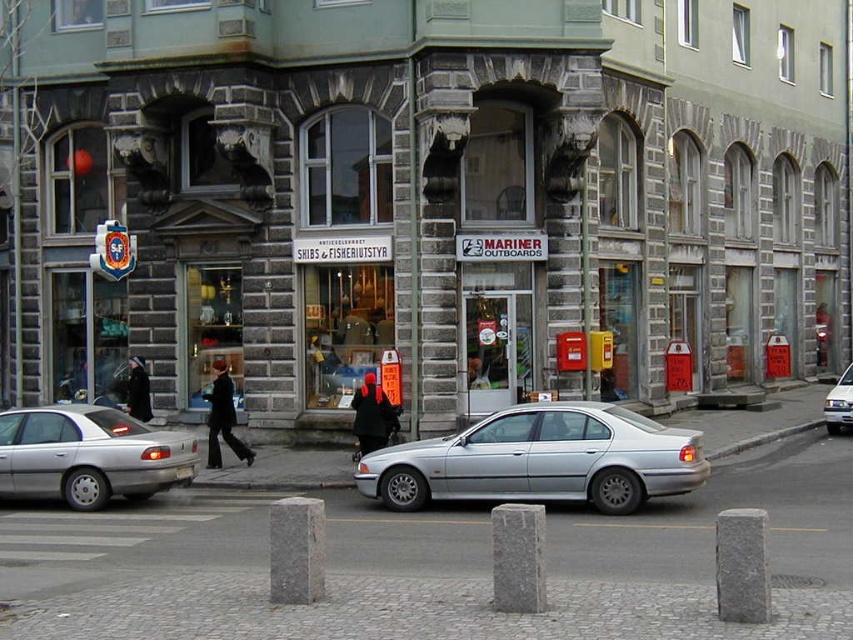
You are a delivery person standing at the entrance of the building. You need to place a package between the dark brown leather coat at center and the black matte coat at center. The package requires 3 meters of space. Is there enough space between them?

The dark brown leather coat at center is 3.28 meters away from the black matte coat at center, so yes, there is enough space between them to place the package since 3.28 meters exceeds the required 3 meters.

You are standing on the pedestrian area in front of the building and see both the dark brown leather coat at center and the black matte coat at center. Which coat is nearer to you?

The dark brown leather coat at center is closer to the viewer than the black matte coat at center.